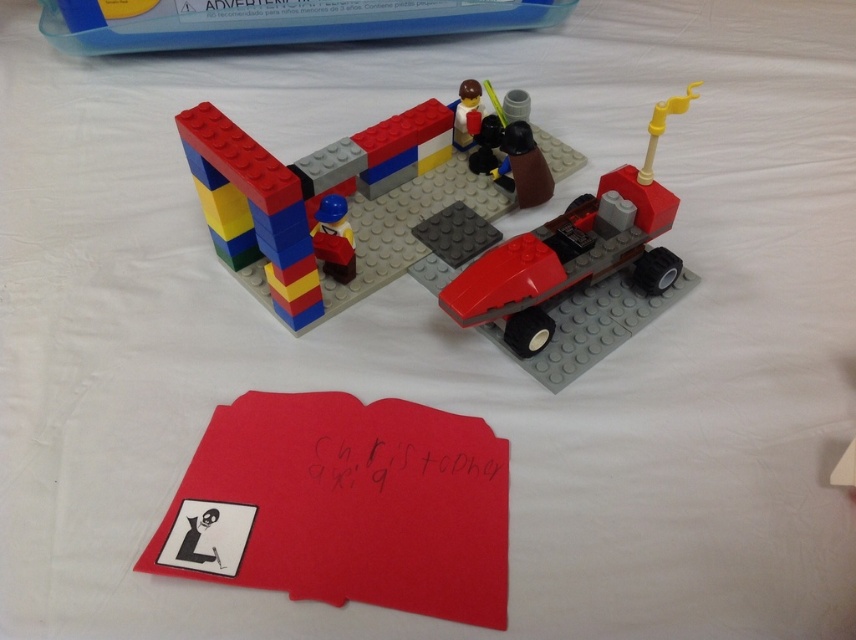
Question: Is shiny red car at center behind translucent blue plastic container at upper center?

Choices:
 (A) no
 (B) yes

Answer: (A)

Question: From the image, what is the correct spatial relationship of shiny red car at center in relation to matte blue helmet at center?

Choices:
 (A) right
 (B) left

Answer: (A)

Question: Based on their relative distances, which object is farther from the translucent blue plastic container at upper center?

Choices:
 (A) matte blue helmet at center
 (B) matte red folder at lower center
 (C) brick-like colorful building at center

Answer: (B)

Question: Estimate the real-world distances between objects in this image. Which object is farther from the translucent blue plastic container at upper center?

Choices:
 (A) shiny red car at center
 (B) matte red folder at lower center
 (C) matte blue helmet at center
 (D) brick-like colorful building at center

Answer: (B)

Question: Can you confirm if shiny red car at center is positioned to the left of translucent blue plastic container at upper center?

Choices:
 (A) no
 (B) yes

Answer: (A)

Question: Which of the following is the farthest from the observer?

Choices:
 (A) brick-like colorful building at center
 (B) matte blue helmet at center
 (C) matte red folder at lower center
 (D) shiny red car at center

Answer: (B)